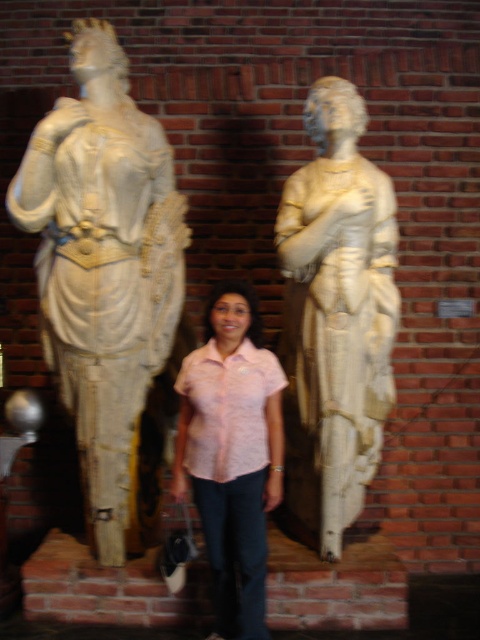
Is the position of white marble statue at left more distant than that of white marble statue at right?

That is False.

Is white marble statue at left bigger than white marble statue at right?

Indeed, white marble statue at left has a larger size compared to white marble statue at right.

Where is `white marble statue at left`? This screenshot has height=640, width=480. white marble statue at left is located at coordinates (103, 264).

Is white marble statue at left below pink textured shirt at center?

No, white marble statue at left is not below pink textured shirt at center.

Describe the element at coordinates (103, 264) in the screenshot. I see `white marble statue at left` at that location.

I want to click on white marble statue at left, so click(x=103, y=264).

Locate an element on the screen. white marble statue at left is located at coordinates (103, 264).

Who is more forward, (376, 300) or (244, 532)?

Positioned in front is point (244, 532).

Is white marble statue at right thinner than pink floral shirt at center?

Incorrect, white marble statue at right's width is not less than pink floral shirt at center's.

You are a GUI agent. You are given a task and a screenshot of the screen. Output one action in this format:
    pyautogui.click(x=<x>, y=<y>)
    Task: Click on the white marble statue at right
    
    Given the screenshot: What is the action you would take?
    pyautogui.click(x=336, y=314)

Locate an element on the screen. Image resolution: width=480 pixels, height=640 pixels. white marble statue at right is located at coordinates [336, 314].